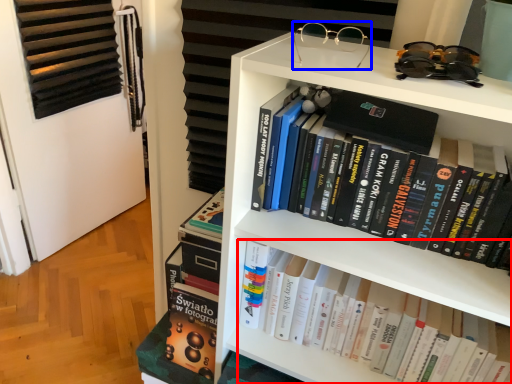
Question: Which object appears farthest to the camera in this image, book (highlighted by a red box) or glasses (highlighted by a blue box)?

Choices:
 (A) book
 (B) glasses

Answer: (A)